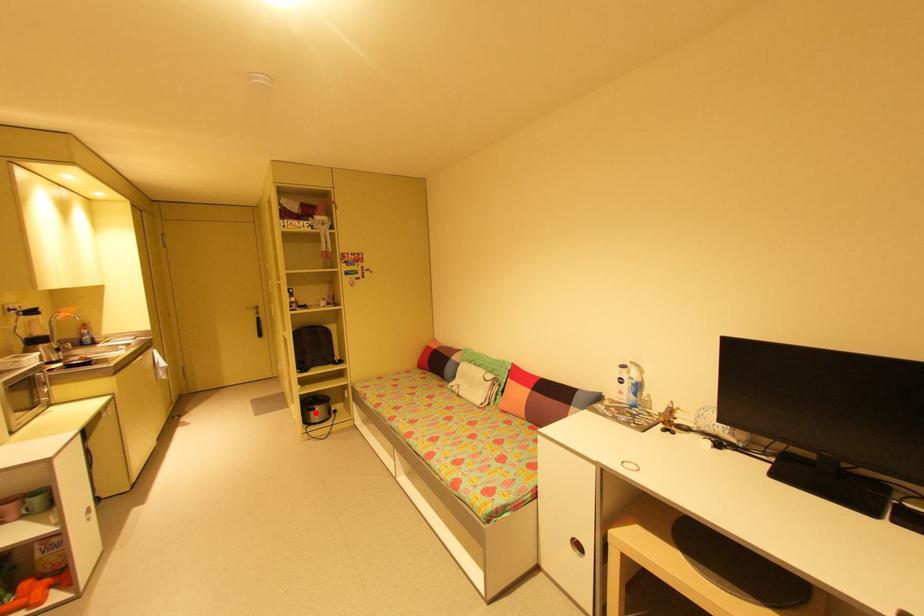
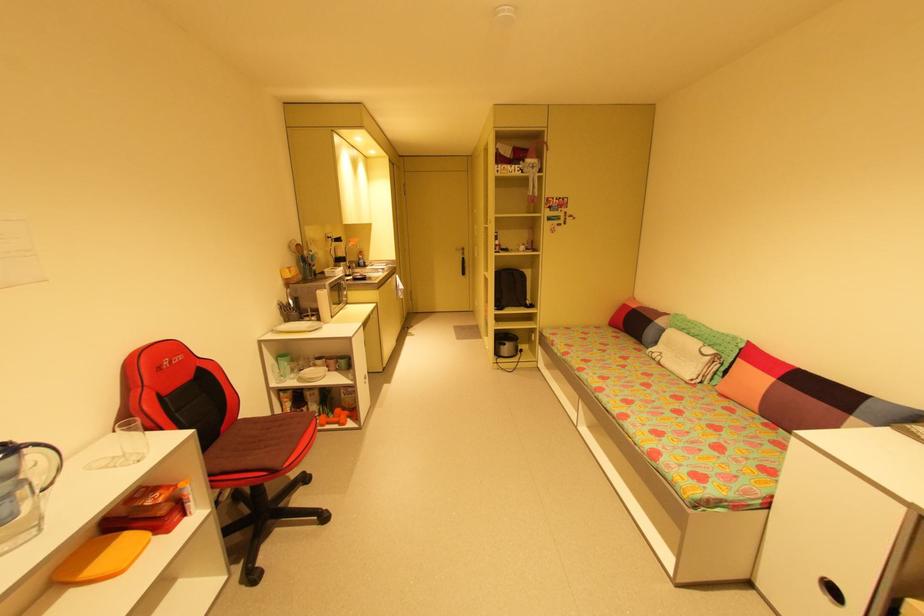
The point at the highlighted location is marked in the first image. Where is the corresponding point in the second image?

(505, 347)